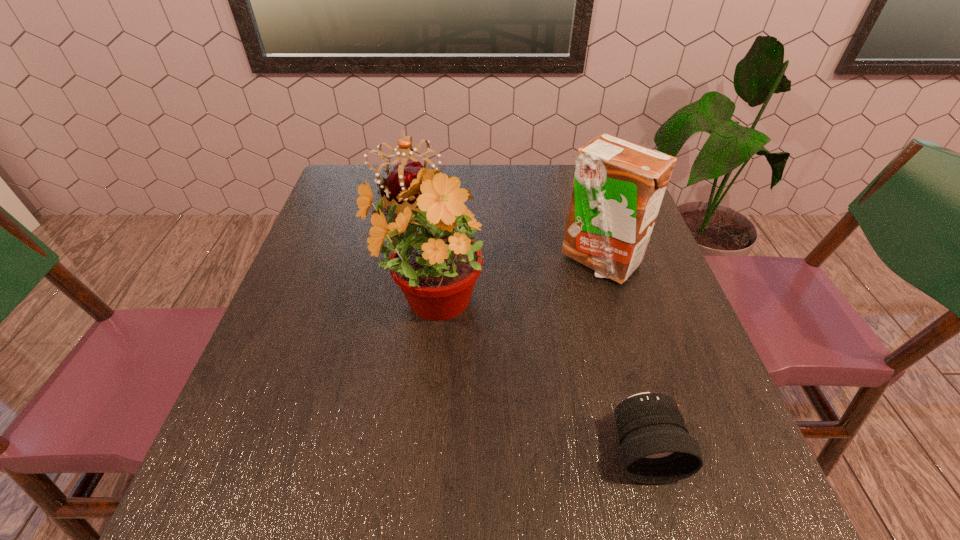
Where is `object that is the closest to the carton`? Image resolution: width=960 pixels, height=540 pixels. object that is the closest to the carton is located at coordinates (436, 266).

Identify which object is the third nearest to the carton. Please provide its 2D coordinates. Your answer should be formatted as a tuple, i.e. [(x, y)], where the tuple contains the x and y coordinates of a point satisfying the conditions above.

[(656, 448)]

Where is `free point that satisfies the following two spatial constraints: 1. on the back side of the tallest object; 2. on the front-facing side of the second shortest object`? free point that satisfies the following two spatial constraints: 1. on the back side of the tallest object; 2. on the front-facing side of the second shortest object is located at coordinates (441, 198).

Where is `vacant space that satisfies the following two spatial constraints: 1. on the front-facing side of the farthest object; 2. on the back side of the flowerpot`? This screenshot has width=960, height=540. vacant space that satisfies the following two spatial constraints: 1. on the front-facing side of the farthest object; 2. on the back side of the flowerpot is located at coordinates (386, 302).